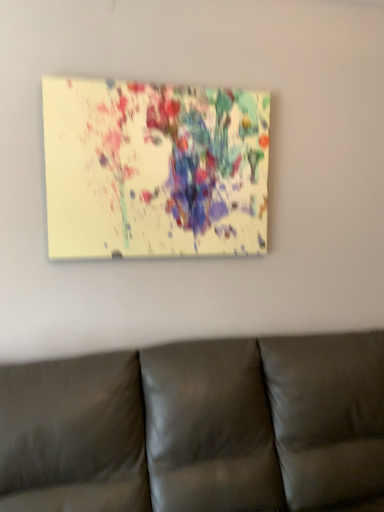
In order to face matte acrylic painting at upper center, should I rotate leftwards or rightwards?

Rotate your view left by about 3.778°.

Where is `matte acrylic painting at upper center`? The height and width of the screenshot is (512, 384). matte acrylic painting at upper center is located at coordinates (154, 170).

The height and width of the screenshot is (512, 384). Describe the element at coordinates (154, 170) in the screenshot. I see `matte acrylic painting at upper center` at that location.

Describe the element at coordinates (198, 428) in the screenshot. The image size is (384, 512). I see `leather couch at lower center` at that location.

You are a GUI agent. You are given a task and a screenshot of the screen. Output one action in this format:
    pyautogui.click(x=<x>, y=<y>)
    Task: Click on the leather couch at lower center
    This screenshot has width=384, height=512.
    Given the screenshot: What is the action you would take?
    pyautogui.click(x=198, y=428)

Measure the distance between leather couch at lower center and camera.

The distance of leather couch at lower center from camera is 1.39 meters.

The image size is (384, 512). In order to click on matte acrylic painting at upper center in this screenshot , I will do `click(154, 170)`.

Based on their positions, is matte acrylic painting at upper center located to the left or right of leather couch at lower center?

In the image, matte acrylic painting at upper center appears on the left side of leather couch at lower center.

Is matte acrylic painting at upper center in front of or behind leather couch at lower center in the image?

In the image, matte acrylic painting at upper center appears behind leather couch at lower center.

Is point (93, 148) less distant than point (195, 397)?

No.

From the image's perspective, which is above, matte acrylic painting at upper center or leather couch at lower center?

From the image's view, matte acrylic painting at upper center is above.

From a real-world perspective, which is physically below, matte acrylic painting at upper center or leather couch at lower center?

leather couch at lower center is physically lower.

Is matte acrylic painting at upper center thinner than leather couch at lower center?

Correct, the width of matte acrylic painting at upper center is less than that of leather couch at lower center.

Between matte acrylic painting at upper center and leather couch at lower center, which one has less height?

matte acrylic painting at upper center.

Between matte acrylic painting at upper center and leather couch at lower center, which one has smaller size?

Smaller between the two is matte acrylic painting at upper center.

Can we say matte acrylic painting at upper center lies outside leather couch at lower center?

matte acrylic painting at upper center lies outside leather couch at lower center's area.

In the scene shown: Is there a large distance between matte acrylic painting at upper center and leather couch at lower center?

They are positioned close to each other.

Is matte acrylic painting at upper center turned away from leather couch at lower center?

No, matte acrylic painting at upper center is not facing away from leather couch at lower center.

This screenshot has width=384, height=512. In the image, there is a matte acrylic painting at upper center. What are the coordinates of `studio couch below it (from the image's perspective)` in the screenshot? It's located at (198, 428).

Is leather couch at lower center to the right of matte acrylic painting at upper center from the viewer's perspective?

Indeed, leather couch at lower center is positioned on the right side of matte acrylic painting at upper center.

Which object is further away from the camera taking this photo, leather couch at lower center or matte acrylic painting at upper center?

matte acrylic painting at upper center.

Considering the points (82, 369) and (241, 117), which point is behind, point (82, 369) or point (241, 117)?

The point (241, 117) is farther from the camera.

From the image's perspective, between leather couch at lower center and matte acrylic painting at upper center, who is located below?

leather couch at lower center.

From a real-world perspective, is leather couch at lower center positioned under matte acrylic painting at upper center based on gravity?

Indeed, from a real-world perspective, leather couch at lower center is positioned beneath matte acrylic painting at upper center.

Based on the photo, does leather couch at lower center have a lesser width compared to matte acrylic painting at upper center?

In fact, leather couch at lower center might be wider than matte acrylic painting at upper center.

Is leather couch at lower center taller or shorter than matte acrylic painting at upper center?

Clearly, leather couch at lower center is taller compared to matte acrylic painting at upper center.

Considering the sizes of objects leather couch at lower center and matte acrylic painting at upper center in the image provided, who is bigger, leather couch at lower center or matte acrylic painting at upper center?

Bigger between the two is leather couch at lower center.

Is leather couch at lower center not within matte acrylic painting at upper center?

Yes.

Is leather couch at lower center far away from matte acrylic painting at upper center?

They are positioned close to each other.

Is leather couch at lower center positioned with its back to matte acrylic painting at upper center?

No.

How distant is leather couch at lower center from matte acrylic painting at upper center?

leather couch at lower center is 28.01 inches away from matte acrylic painting at upper center.

You are a GUI agent. You are given a task and a screenshot of the screen. Output one action in this format:
    pyautogui.click(x=<x>, y=<y>)
    Task: Click on the picture frame that is behind the leather couch at lower center
    The image size is (384, 512).
    Given the screenshot: What is the action you would take?
    pyautogui.click(x=154, y=170)

Image resolution: width=384 pixels, height=512 pixels. In order to click on studio couch below the matte acrylic painting at upper center (from the image's perspective) in this screenshot , I will do `click(198, 428)`.

The width and height of the screenshot is (384, 512). Find the location of `studio couch located underneath the matte acrylic painting at upper center (from a real-world perspective)`. studio couch located underneath the matte acrylic painting at upper center (from a real-world perspective) is located at coordinates (198, 428).